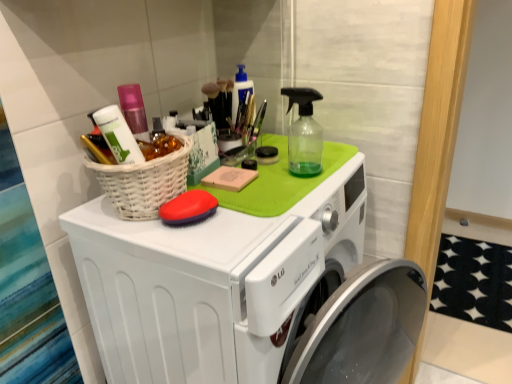
Locate an element on the screen. This screenshot has height=384, width=512. vacant area located to the right-hand side of white wicker basket at upper left is located at coordinates (252, 214).